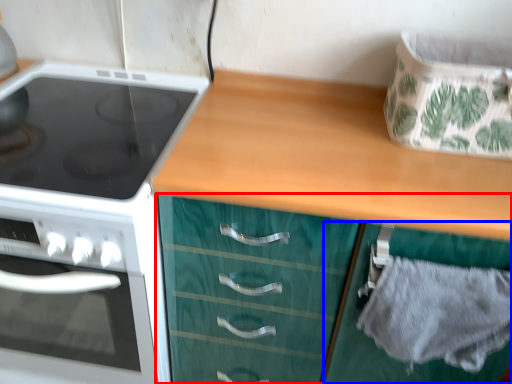
Question: Which object appears closest to the camera in this image, cabinetry (highlighted by a red box) or cabinetry (highlighted by a blue box)?

Choices:
 (A) cabinetry
 (B) cabinetry

Answer: (A)